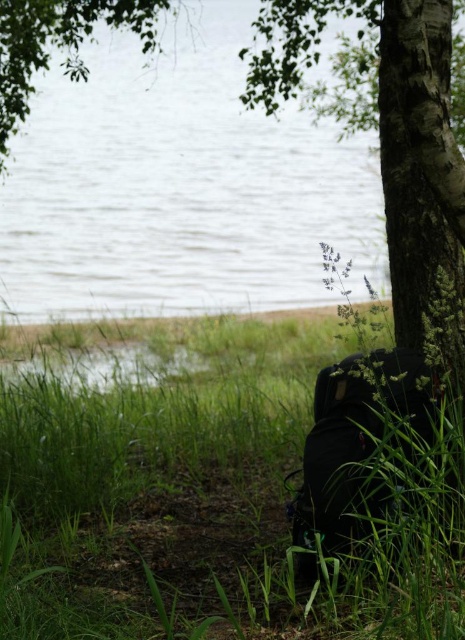
Question: Which point is farther to the camera?

Choices:
 (A) clear water at center
 (B) green matte grass at lower right

Answer: (A)

Question: Which point is farther to the camera?

Choices:
 (A) green matte grass at lower right
 (B) clear water at center

Answer: (B)

Question: Is green matte grass at lower right thinner than clear water at center?

Choices:
 (A) yes
 (B) no

Answer: (A)

Question: Can you confirm if green matte grass at lower right is bigger than clear water at center?

Choices:
 (A) yes
 (B) no

Answer: (B)

Question: In this image, where is green matte grass at lower right located relative to clear water at center?

Choices:
 (A) left
 (B) right

Answer: (B)

Question: Which of the following is the farthest from the observer?

Choices:
 (A) (240, 64)
 (B) (161, 506)

Answer: (A)